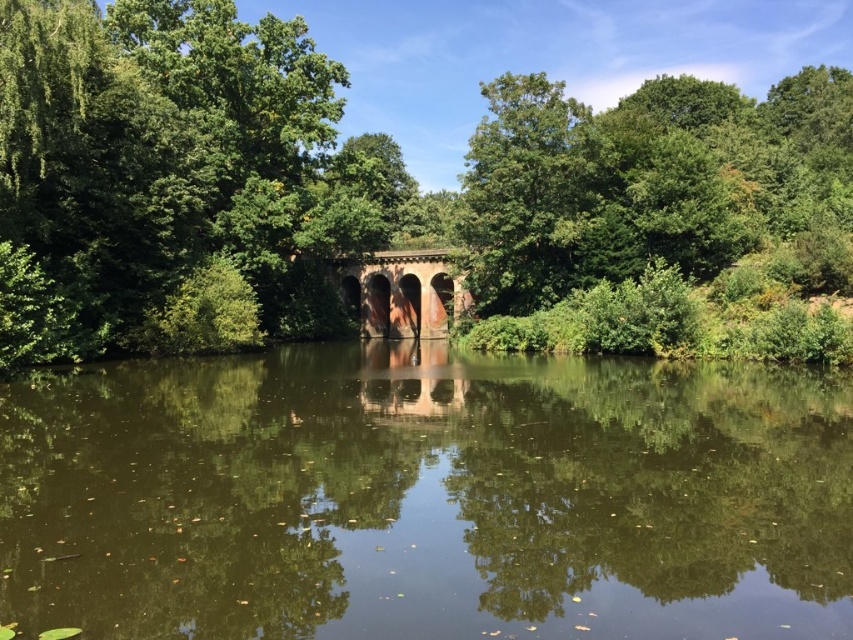
Does green reflective water at center have a larger size compared to rustic stone bridge at center?

No.

Does point (840, 426) come behind point (408, 317)?

No, (840, 426) is in front of (408, 317).

Does point (724, 605) lie behind point (450, 292)?

That is False.

The height and width of the screenshot is (640, 853). In order to click on green reflective water at center in this screenshot , I will do `click(427, 499)`.

Consider the image. Does green reflective water at center have a greater height compared to green leafy tree at center?

No, green reflective water at center is not taller than green leafy tree at center.

Does green reflective water at center appear on the right side of green leafy tree at center?

No, green reflective water at center is not to the right of green leafy tree at center.

Is point (752, 576) positioned after point (659, 339)?

That is False.

The image size is (853, 640). Find the location of `green reflective water at center`. green reflective water at center is located at coordinates (427, 499).

Who is more distant from viewer, (315, 227) or (363, 316)?

The point (363, 316) is behind.

Between green leafy tree at center and rustic stone bridge at center, which one appears on the right side from the viewer's perspective?

Positioned to the right is green leafy tree at center.

Locate an element on the screen. The image size is (853, 640). green leafy tree at center is located at coordinates (390, 198).

The height and width of the screenshot is (640, 853). What are the coordinates of `green leafy tree at center` in the screenshot? It's located at (390, 198).